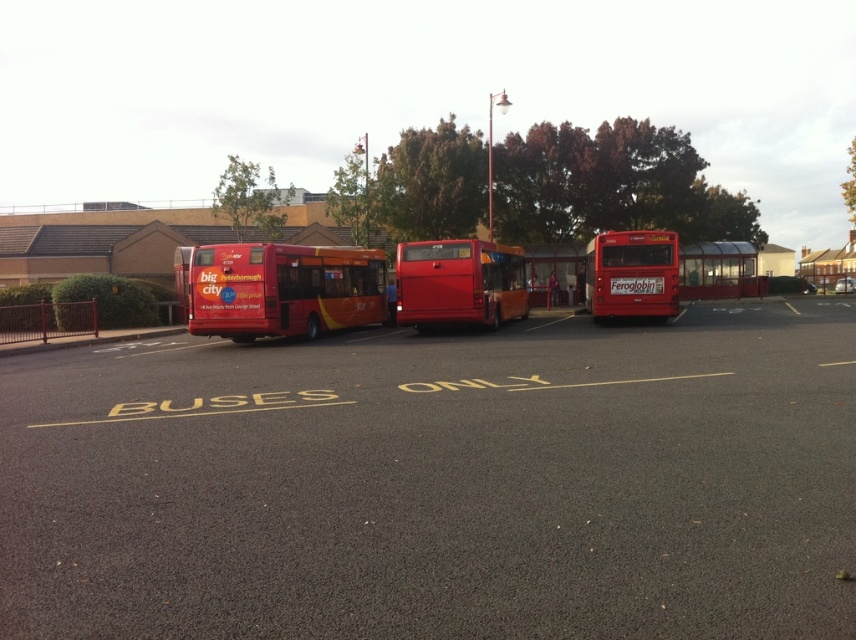
You are a pedestrian standing at the edge of the smooth asphalt parking lot at center and want to cross to the matte red bus at left. Which direction should you walk to reach the bus?

The smooth asphalt parking lot at center is to the right of the matte red bus at left, so you should walk to the left to reach the matte red bus at left.

You are a delivery person trying to park your van next to the shiny red bus at center and the metallic red bus stop at center. Based on their widths, can you safely park your van between them without touching either?

The shiny red bus at center might be wider than the metallic red bus stop at center, so there might not be enough space to park your van between them safely. Check the width before proceeding.